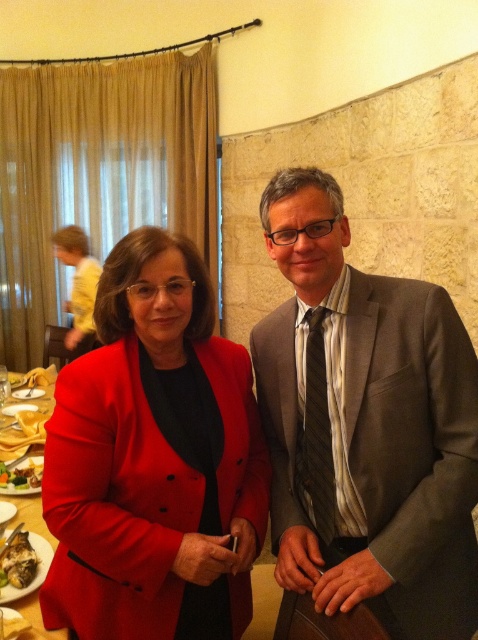
Does point (21, 563) come behind point (17, 484)?

No, it is not.

Is point (1, 576) positioned before point (36, 481)?

Yes, point (1, 576) is closer to viewer.

The height and width of the screenshot is (640, 478). I want to click on shiny silver oyster at lower left, so click(x=19, y=561).

Does point (83, 301) come closer to viewer compared to point (19, 486)?

No, (83, 301) is behind (19, 486).

Does yellow cotton shirt at left appear on the left side of smooth yellow plate at lower left?

Correct, you'll find yellow cotton shirt at left to the left of smooth yellow plate at lower left.

Which is behind, point (77, 280) or point (24, 460)?

The point (77, 280) is more distant.

The image size is (478, 640). Find the location of `yellow cotton shirt at left`. yellow cotton shirt at left is located at coordinates (77, 282).

Does matte red blazer at center have a lesser height compared to shiny silver oyster at lower left?

Incorrect, matte red blazer at center's height does not fall short of shiny silver oyster at lower left's.

Who is more forward, [57,564] or [35,554]?

Point [57,564] is more forward.

Is point (94, 456) less distant than point (21, 545)?

Yes, it is.

The width and height of the screenshot is (478, 640). I want to click on matte red blazer at center, so click(153, 460).